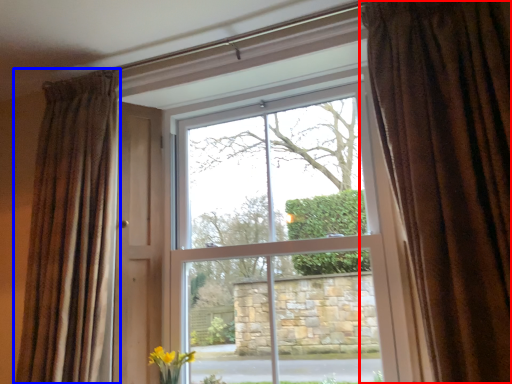
Question: Which point is closer to the camera, curtain (highlighted by a red box) or curtain (highlighted by a blue box)?

Choices:
 (A) curtain
 (B) curtain

Answer: (A)